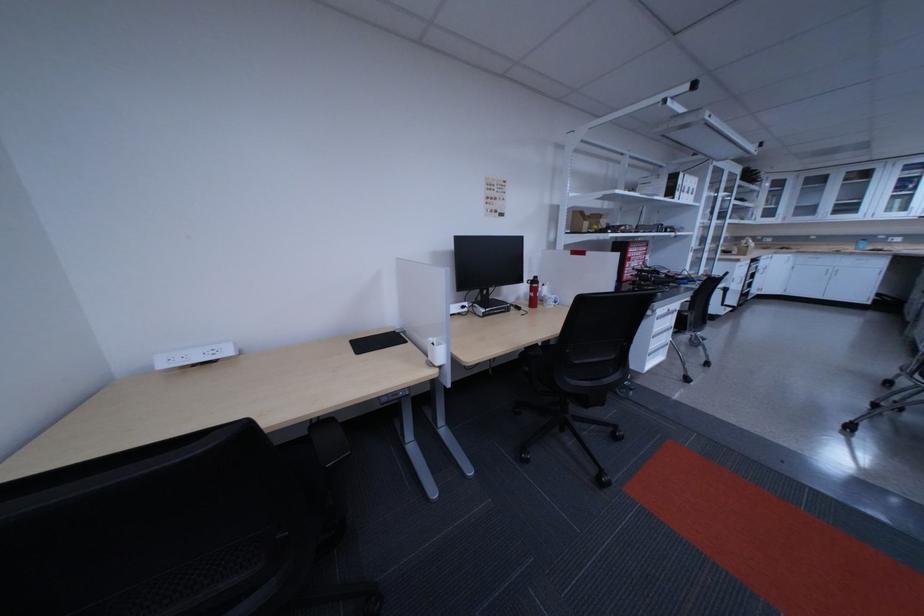
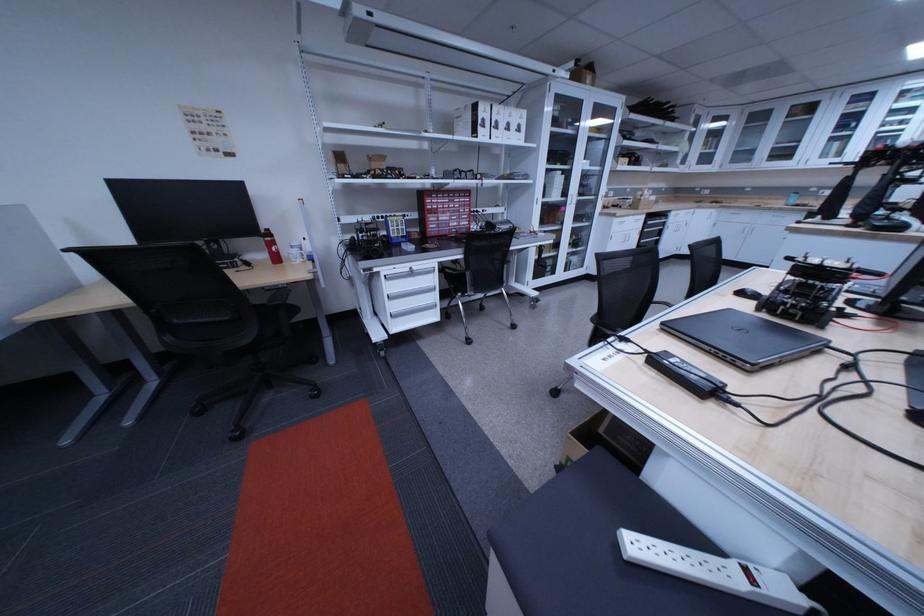
The point at [703,193] is marked in the first image. Where is the corresponding point in the second image?

(524, 130)